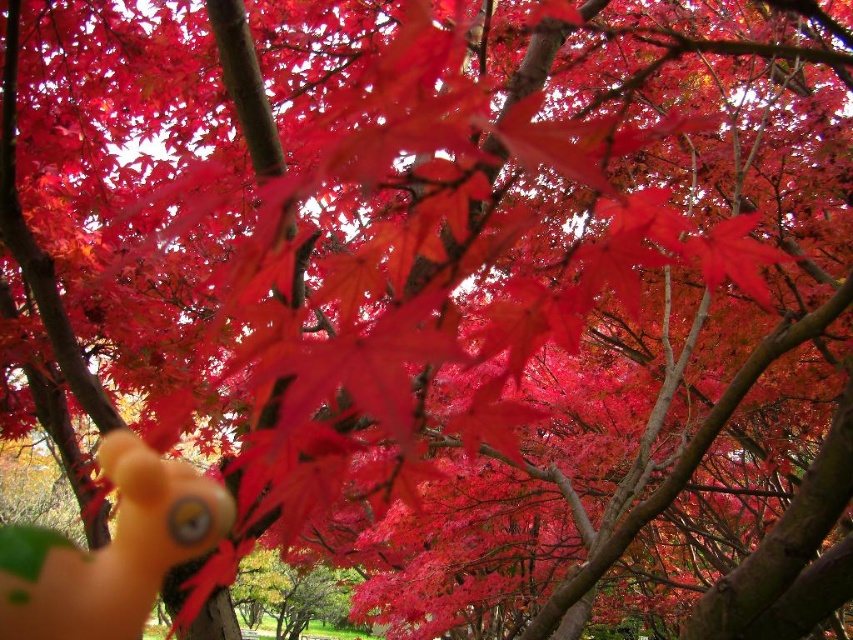
You are holding a camera and want to take a photo of both the rubber duck at lower left and the glossy red maple leaf at upper right. Which object appears smaller in the frame?

The rubber duck at lower left appears smaller in the frame because it has a lesser height compared to the glossy red maple leaf at upper right.

You are holding a camera and want to take a photo of both the rubber duck at lower left and the glossy red maple leaf at upper right. Which object will appear larger in the photo?

The rubber duck at lower left will appear larger in the photo because it is closer to the viewer than the glossy red maple leaf at upper right.

Based on the photo, you are holding a camera and want to take a photo of the rubber duck at lower left and the glossy red maple leaf at upper right. Which object will appear smaller in the photo?

The rubber duck at lower left will appear smaller in the photo because it has a lesser width compared to the glossy red maple leaf at upper right.